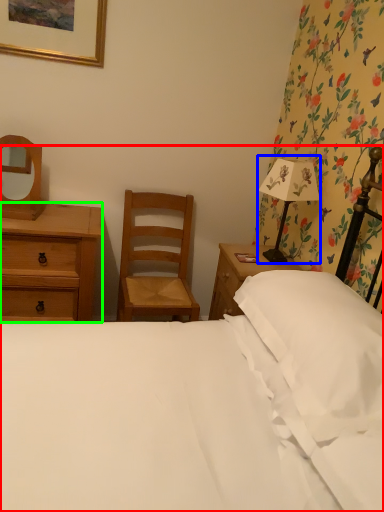
Question: Which object is positioned closest to bed (highlighted by a red box)? Select from bedside lamp (highlighted by a blue box) and chest of drawers (highlighted by a green box).

Choices:
 (A) bedside lamp
 (B) chest of drawers

Answer: (A)